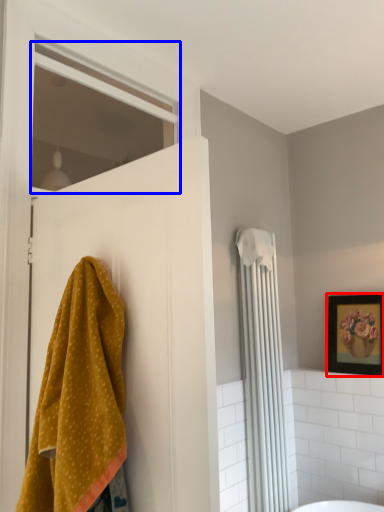
Question: Among these objects, which one is nearest to the camera, picture frame (highlighted by a red box) or window (highlighted by a blue box)?

Choices:
 (A) picture frame
 (B) window

Answer: (B)